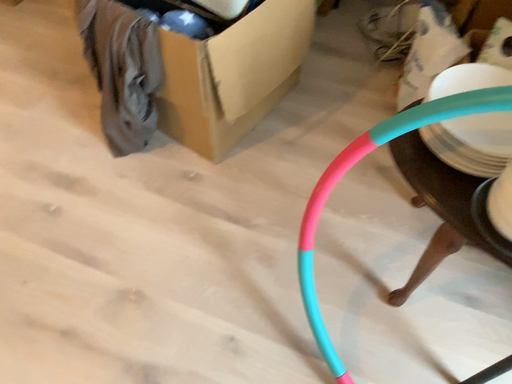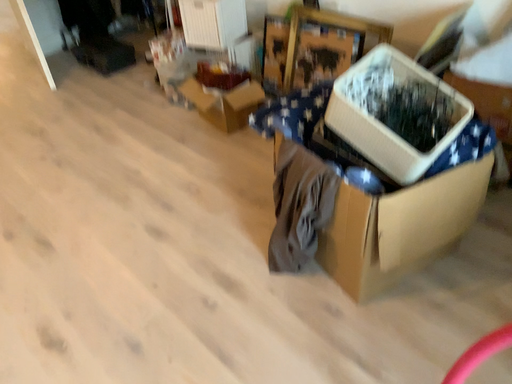
Question: Which way did the camera rotate in the video?

Choices:
 (A) rotated left
 (B) rotated right

Answer: (A)